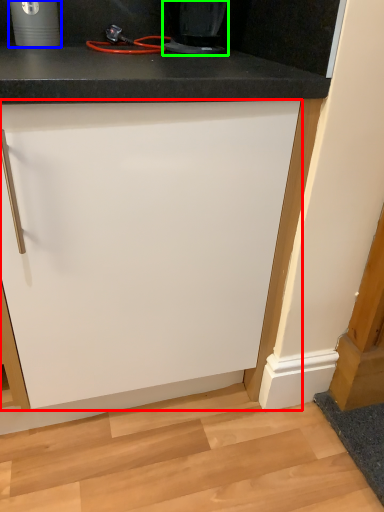
Question: Which object is the farthest from cabinetry (highlighted by a red box)? Choose among these: appliance (highlighted by a blue box) or home appliance (highlighted by a green box).

Choices:
 (A) appliance
 (B) home appliance

Answer: (A)